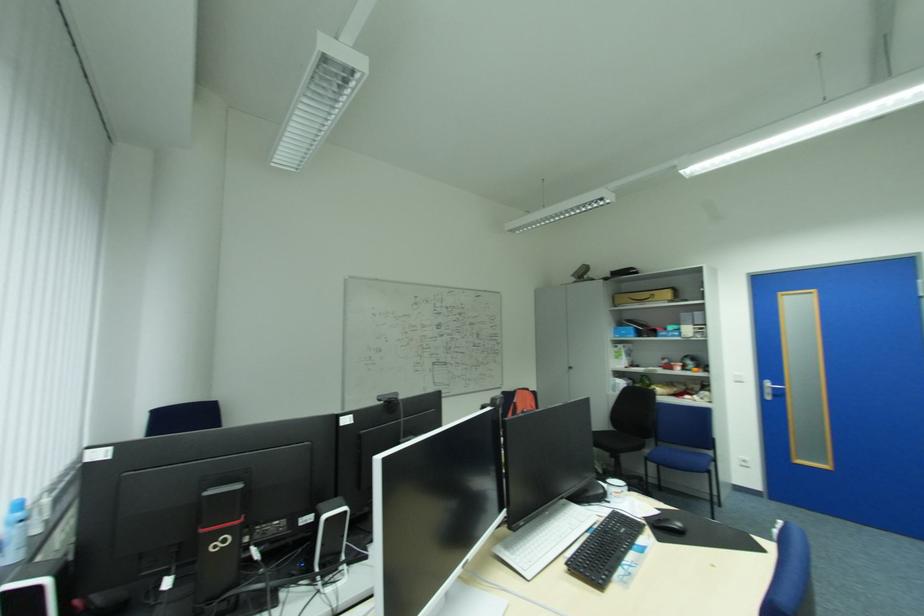
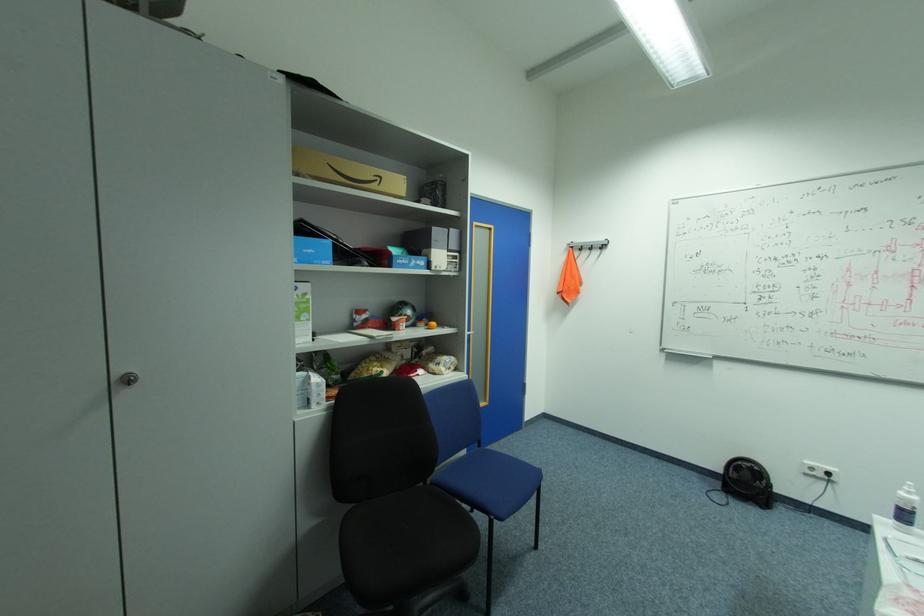
Find the pixel in the second image that matches point (659, 294) in the first image.

(386, 177)